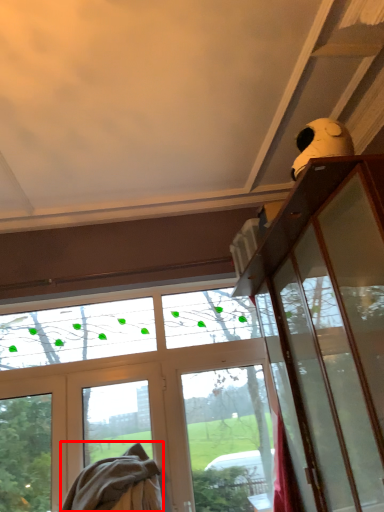
Question: From the image's perspective, where is blanket (annotated by the red box) located relative to screen door?

Choices:
 (A) below
 (B) above

Answer: (A)